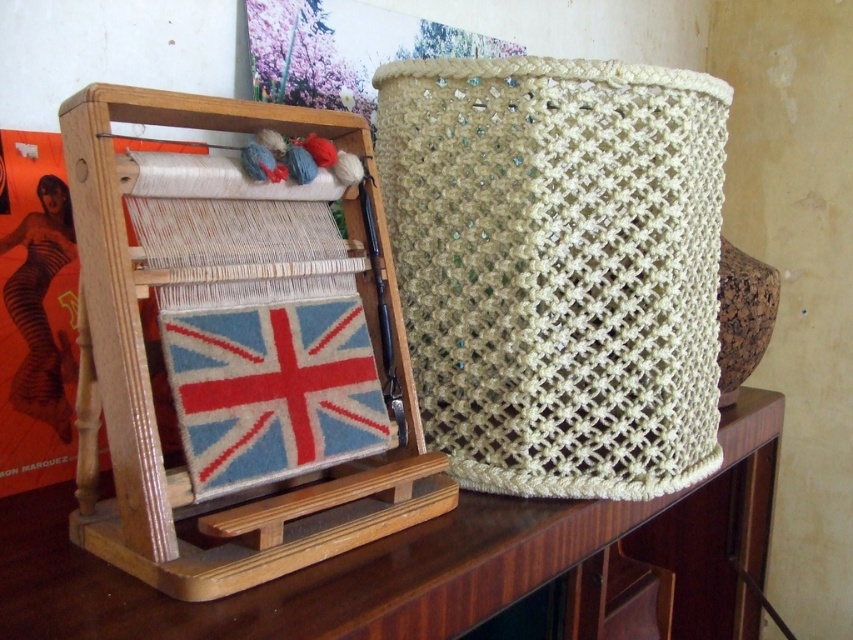
Is point (735, 403) positioned behind point (282, 445)?

Yes, point (735, 403) is behind point (282, 445).

Is wooden table at center thinner than woolen union jack at center?

No, wooden table at center is not thinner than woolen union jack at center.

Who is more distant from viewer, (328, 605) or (227, 413)?

Point (227, 413)

This screenshot has height=640, width=853. In order to click on wooden table at center in this screenshot , I will do `click(310, 576)`.

Is beige woven basket at center above wooden table at center?

Yes, beige woven basket at center is above wooden table at center.

Can you confirm if beige woven basket at center is positioned to the right of wooden table at center?

Yes, beige woven basket at center is to the right of wooden table at center.

Who is more distant from viewer, (514, 218) or (399, 568)?

The point (514, 218) is behind.

Find the location of a particular element. This screenshot has width=853, height=640. beige woven basket at center is located at coordinates (558, 268).

Who is positioned more to the left, beige woven basket at center or woolen union jack at center?

woolen union jack at center is more to the left.

Can you confirm if beige woven basket at center is thinner than woolen union jack at center?

No.

Between point (717, 148) and point (230, 381), which one is positioned in front?

Positioned in front is point (230, 381).

I want to click on beige woven basket at center, so click(558, 268).